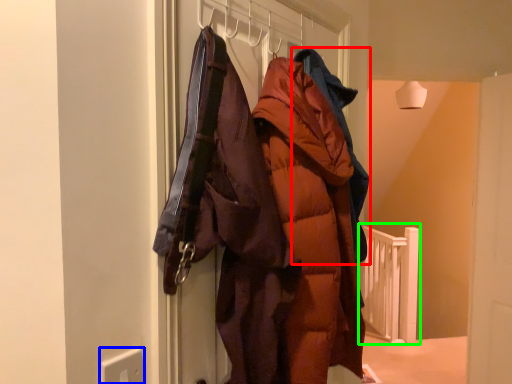
Question: Which object is the farthest from jacket (highlighted by a red box)? Choose among these: electric outlet (highlighted by a blue box) or rail (highlighted by a green box).

Choices:
 (A) electric outlet
 (B) rail

Answer: (B)